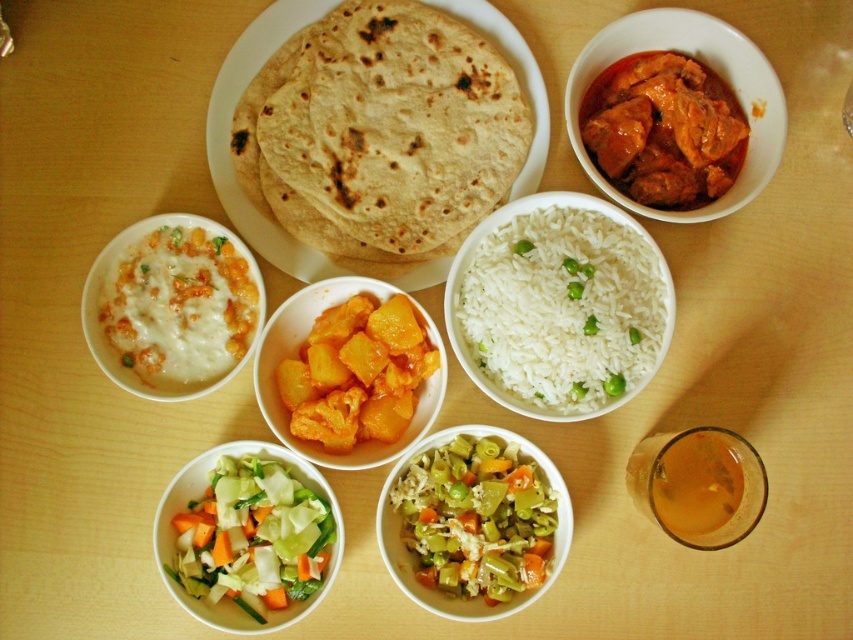
Does fresh green leafy vegetables at lower left appear on the right side of shiny green vegetables at center?

No, fresh green leafy vegetables at lower left is not to the right of shiny green vegetables at center.

This screenshot has width=853, height=640. What are the coordinates of `fresh green leafy vegetables at lower left` in the screenshot? It's located at (247, 538).

I want to click on fresh green leafy vegetables at lower left, so click(247, 538).

Looking at this image, is fresh green leafy vegetables at lower left further to the viewer compared to translucent glass cup at lower right?

Yes.

Does fresh green leafy vegetables at lower left have a lesser width compared to translucent glass cup at lower right?

No.

At what (x,y) coordinates should I click in order to perform the action: click on fresh green leafy vegetables at lower left. Please return your answer as a coordinate pair (x, y). The height and width of the screenshot is (640, 853). Looking at the image, I should click on (247, 538).

Does shiny green vegetables at center appear under translucent glass cup at lower right?

Yes.

You are a GUI agent. You are given a task and a screenshot of the screen. Output one action in this format:
    pyautogui.click(x=<x>, y=<y>)
    Task: Click on the shiny green vegetables at center
    The width and height of the screenshot is (853, 640).
    Given the screenshot: What is the action you would take?
    pyautogui.click(x=474, y=522)